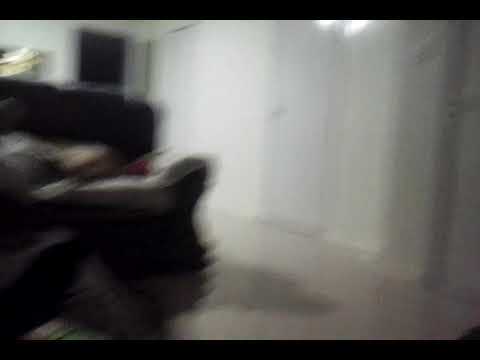
The image size is (480, 360). What are the coordinates of `couch's shadow on the floor` in the screenshot? It's located at (250, 290).